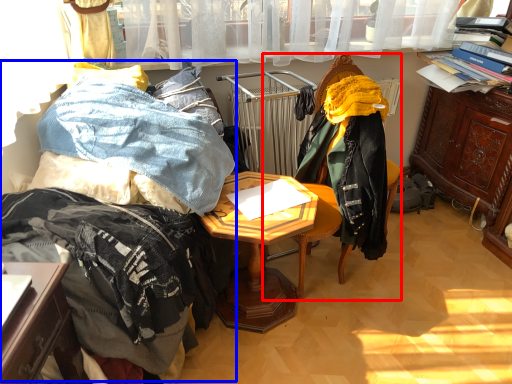
Question: Which of the following is the farthest to the observer, chair (highlighted by a red box) or bed (highlighted by a blue box)?

Choices:
 (A) chair
 (B) bed

Answer: (A)